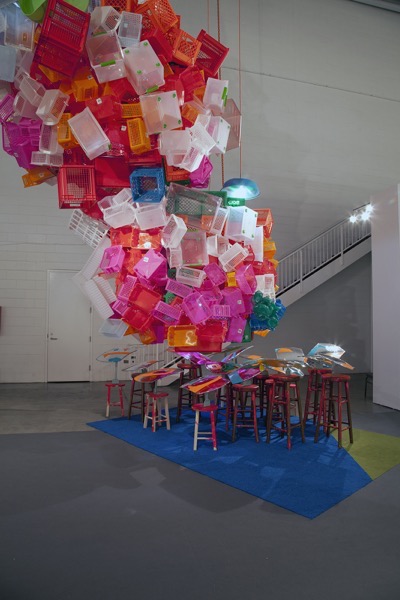
Identify the location of staircase. (334, 264).